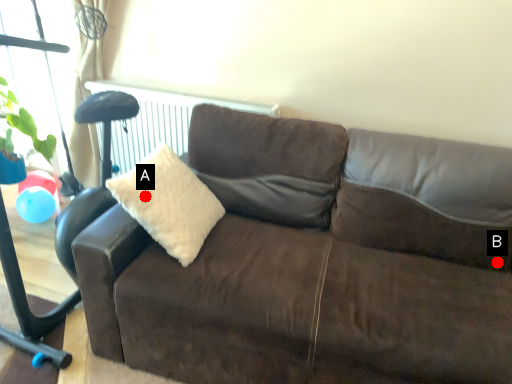
Question: Two points are circled on the image, labeled by A and B beside each circle. Among these points, which one is nearest to the camera?

Choices:
 (A) A is closer
 (B) B is closer

Answer: (A)